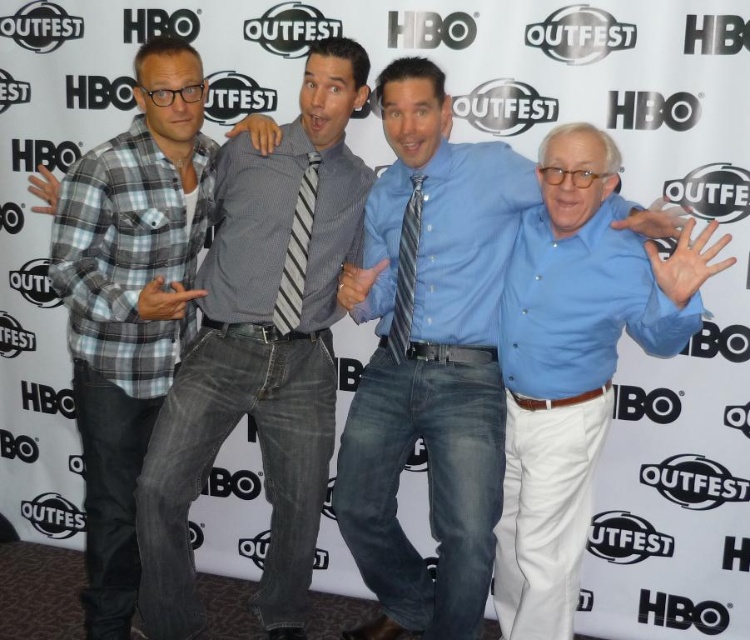
Question: Can you confirm if plaid flannel shirt at left is positioned above striped fabric tie at center?

Choices:
 (A) no
 (B) yes

Answer: (A)

Question: Which point is farther to the camera?

Choices:
 (A) (596, 236)
 (B) (392, 356)

Answer: (B)

Question: Which object is farther from the camera taking this photo?

Choices:
 (A) plaid flannel shirt at left
 (B) gray striped tie at center
 (C) blue striped tie at center

Answer: (B)

Question: Estimate the real-world distances between objects in this image. Which object is closer to the striped fabric tie at center?

Choices:
 (A) blue striped tie at center
 (B) gray striped tie at center

Answer: (A)

Question: Is light blue button-down shirt at right wider than plaid flannel shirt at left?

Choices:
 (A) no
 (B) yes

Answer: (A)

Question: Does gray striped tie at center appear under striped fabric tie at center?

Choices:
 (A) no
 (B) yes

Answer: (A)